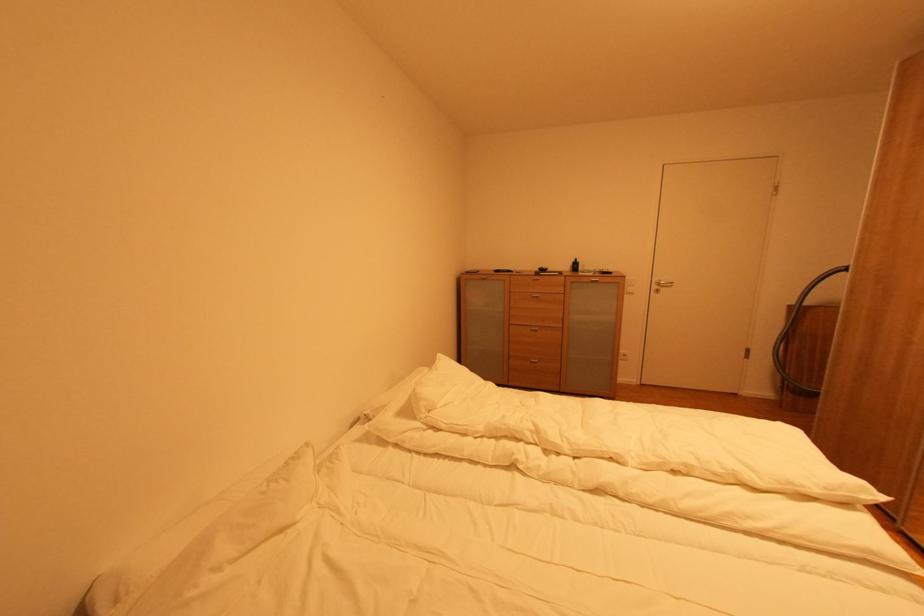
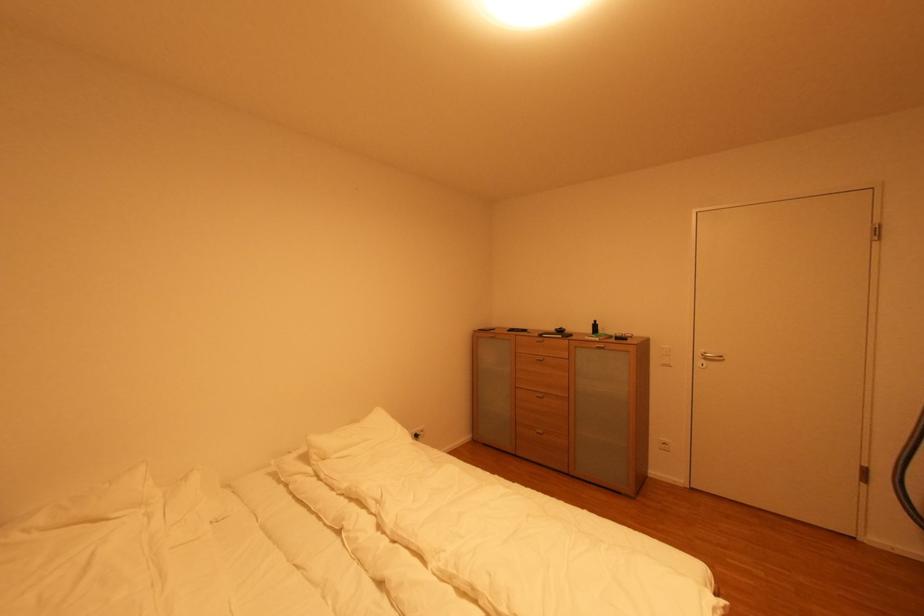
Find the pixel in the second image that matches (616,274) in the first image.

(630, 339)